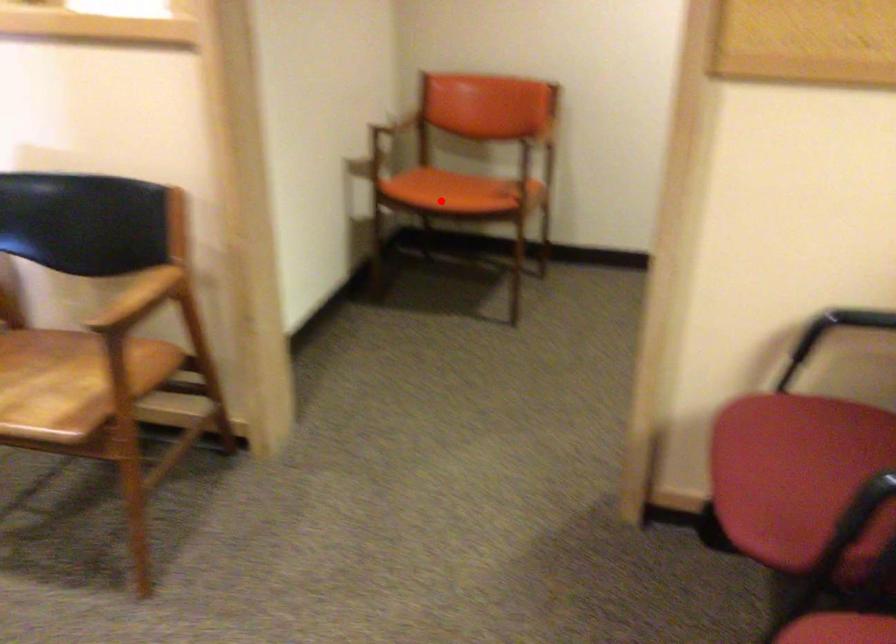
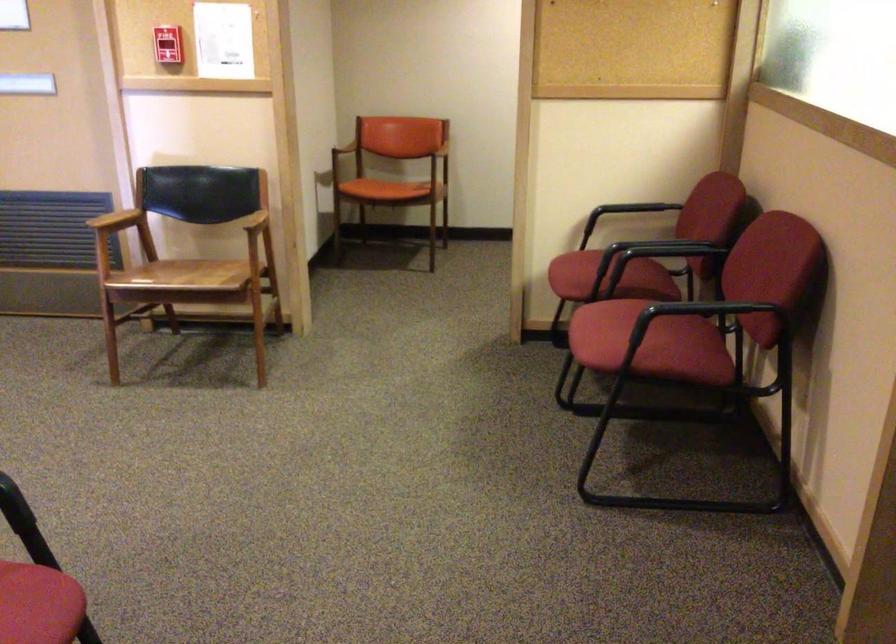
Where in the second image is the point corresponding to the highlighted location from the first image?

(383, 189)